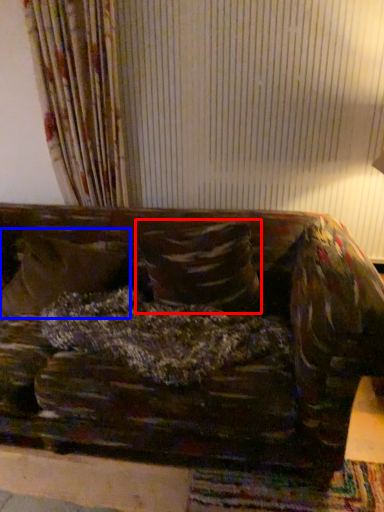
Question: Among these objects, which one is nearest to the camera, pillow (highlighted by a red box) or pillow (highlighted by a blue box)?

Choices:
 (A) pillow
 (B) pillow

Answer: (A)